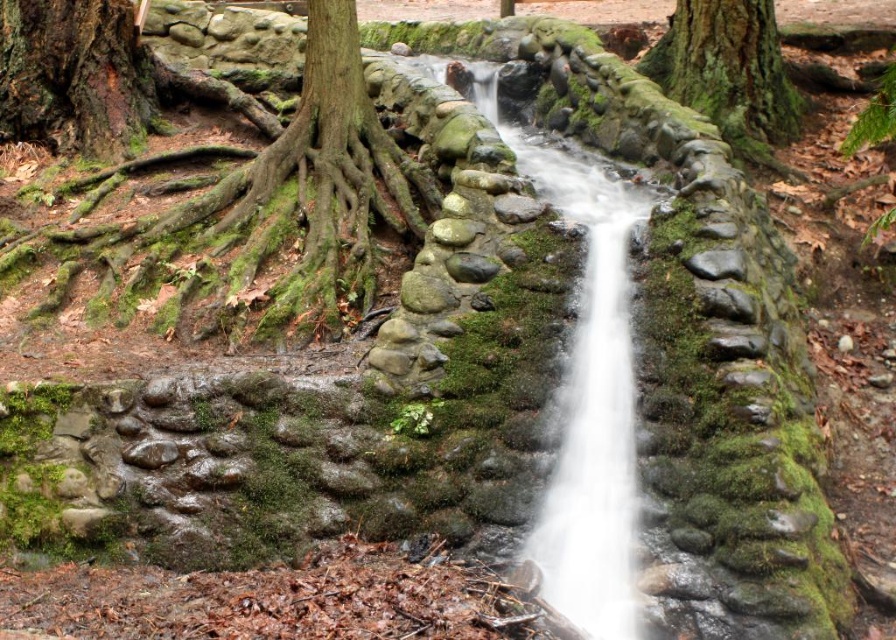
You are standing at the base of the waterfall and want to walk towards the two points marked in the scene. Which point, point [35,74] or point [589,493], will you reach first?

Point [35,74] is closer to you than point [589,493], so you will reach point [35,74] first.

You are a hiker who wants to cross the area near the waterfall. You see the green mossy roots at left and the green mossy tree trunk at upper right. Which object is closer to you as you approach the waterfall?

The green mossy roots at left are closer to you because they are in front of the green mossy tree trunk at upper right.